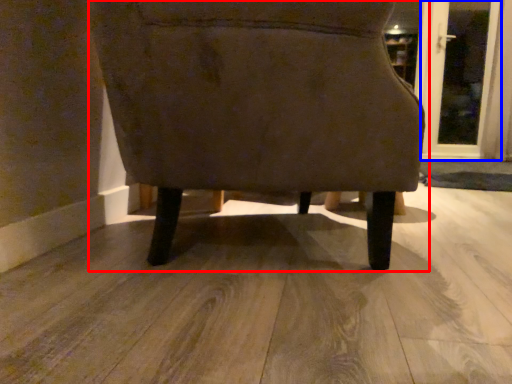
Question: Which point is closer to the camera, chair (highlighted by a red box) or screen door (highlighted by a blue box)?

Choices:
 (A) chair
 (B) screen door

Answer: (A)